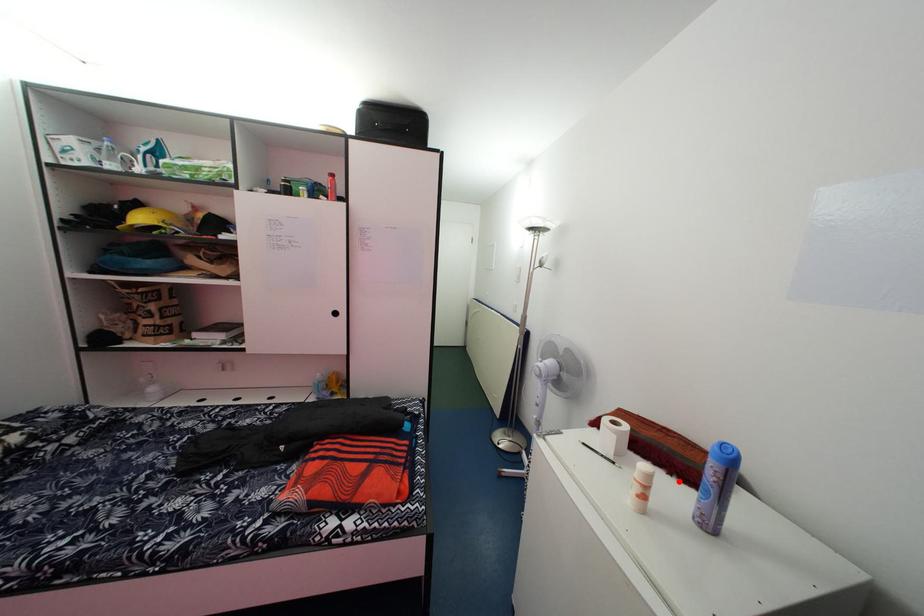
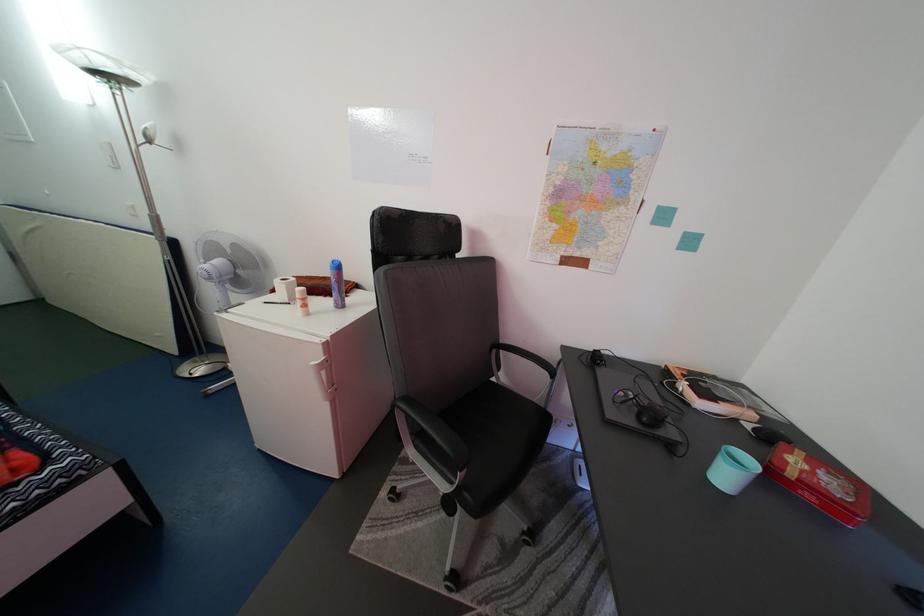
Question: I am providing you with two images of the same scene from different viewpoints. Given a red point in image1, look at the same physical point in image2. Is it:

Choices:
 (A) Closer to the viewpoint
 (B) Farther from the viewpoint

Answer: (B)